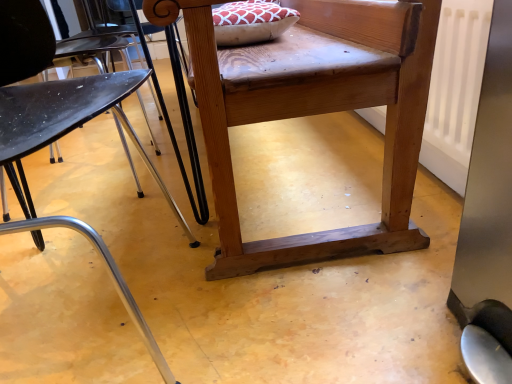
Where is `natural wood chair at center`? The image size is (512, 384). natural wood chair at center is located at coordinates (314, 110).

Describe the element at coordinates (314, 110) in the screenshot. I see `natural wood chair at center` at that location.

Locate an element on the screen. The height and width of the screenshot is (384, 512). metallic black chair at left is located at coordinates (59, 128).

In order to face metallic black chair at left, should I rotate leftwards or rightwards?

→ A 28.929 degree turn to the left will do.

What is the approximate width of metallic black chair at left?

The width of metallic black chair at left is 19.70 inches.

What do you see at coordinates (59, 128) in the screenshot? I see `metallic black chair at left` at bounding box center [59, 128].

Image resolution: width=512 pixels, height=384 pixels. Identify the location of natural wood chair at center. (314, 110).

Is metallic black chair at left to the left or to the right of natural wood chair at center in the image?

From the image, it's evident that metallic black chair at left is to the left of natural wood chair at center.

Is metallic black chair at left closer to camera compared to natural wood chair at center?

Yes, metallic black chair at left is closer to the viewer.

Which is farther, (90, 107) or (415, 88)?

Point (415, 88)

Based on the photo, from the image's perspective, is metallic black chair at left located above or below natural wood chair at center?

Based on their image positions, metallic black chair at left is located beneath natural wood chair at center.

From a real-world perspective, between metallic black chair at left and natural wood chair at center, who is vertically higher?

From a 3D spatial view, metallic black chair at left is above.

Is metallic black chair at left wider than natural wood chair at center?

Incorrect, the width of metallic black chair at left does not surpass that of natural wood chair at center.

Is metallic black chair at left taller or shorter than natural wood chair at center?

Clearly, metallic black chair at left is taller compared to natural wood chair at center.

Can you confirm if metallic black chair at left is smaller than natural wood chair at center?

Correct, metallic black chair at left occupies less space than natural wood chair at center.

Consider the image. Choose the correct answer: Is metallic black chair at left inside natural wood chair at center or outside it?

metallic black chair at left is not inside natural wood chair at center, it's outside.

Can you see metallic black chair at left touching natural wood chair at center?

No, metallic black chair at left is not touching natural wood chair at center.

Is metallic black chair at left positioned with its back to natural wood chair at center?

No, metallic black chair at left is not facing away from natural wood chair at center.

How different are the orientations of metallic black chair at left and natural wood chair at center in degrees?

There is a 90.7-degree angle between the facing directions of metallic black chair at left and natural wood chair at center.

The width and height of the screenshot is (512, 384). What are the coordinates of `chair on the left of natural wood chair at center` in the screenshot? It's located at (59, 128).

Which is more to the left, natural wood chair at center or metallic black chair at left?

From the viewer's perspective, metallic black chair at left appears more on the left side.

From the picture: Is natural wood chair at center in front of or behind metallic black chair at left in the image?

Clearly, natural wood chair at center is behind metallic black chair at left.

Is point (220, 191) closer to camera compared to point (12, 154)?

No, it is behind (12, 154).

From the image's perspective, is natural wood chair at center beneath metallic black chair at left?

Incorrect, from the image's perspective, natural wood chair at center is higher than metallic black chair at left.

From a real-world perspective, is natural wood chair at center positioned above or below metallic black chair at left?

natural wood chair at center is below metallic black chair at left.

Considering the sizes of natural wood chair at center and metallic black chair at left in the image, is natural wood chair at center wider or thinner than metallic black chair at left?

Considering their sizes, natural wood chair at center looks broader than metallic black chair at left.

Between natural wood chair at center and metallic black chair at left, which one has less height?

Standing shorter between the two is natural wood chair at center.

Who is bigger, natural wood chair at center or metallic black chair at left?

Bigger between the two is natural wood chair at center.

Is metallic black chair at left inside natural wood chair at center?

Actually, metallic black chair at left is outside natural wood chair at center.

Would you say natural wood chair at center is a long distance from metallic black chair at left?

They are positioned close to each other.

Is metallic black chair at left at the back of natural wood chair at center?

No, natural wood chair at center's orientation is not away from metallic black chair at left.

How many degrees apart are the facing directions of natural wood chair at center and metallic black chair at left?

90.7 degrees separate the facing orientations of natural wood chair at center and metallic black chair at left.

Find the location of `table on the right of metallic black chair at left`. table on the right of metallic black chair at left is located at coordinates (314, 110).

The width and height of the screenshot is (512, 384). What are the coordinates of `table behind the metallic black chair at left` in the screenshot? It's located at (314, 110).

Identify the location of chair in front of the natural wood chair at center. click(x=59, y=128).